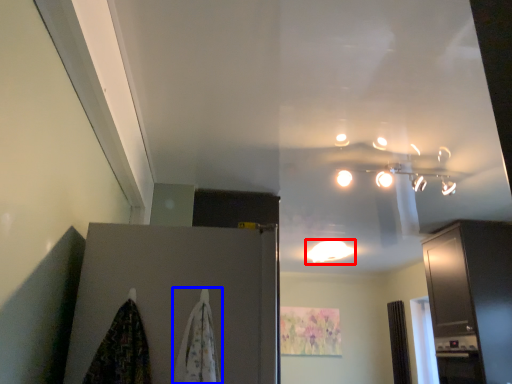
Question: Which object appears closest to the camera in this image, lighting (highlighted by a red box) or curtain (highlighted by a blue box)?

Choices:
 (A) lighting
 (B) curtain

Answer: (B)